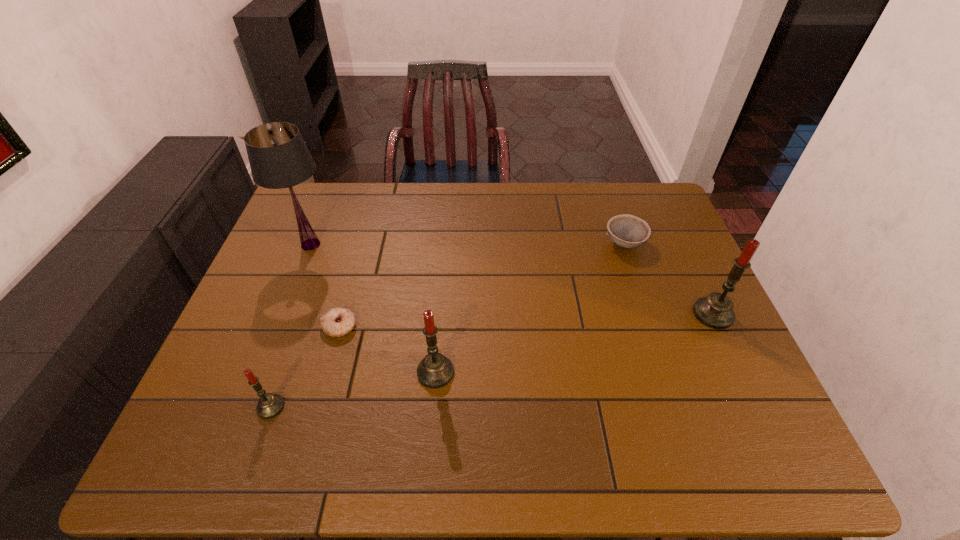
Where is `free spot between the shortest object and the second shortest candle`? free spot between the shortest object and the second shortest candle is located at coordinates (387, 349).

This screenshot has width=960, height=540. I want to click on free spot between the rightmost object and the nearest object, so click(x=492, y=360).

Where is `vacant point located between the rightmost candle and the second shortest object`? This screenshot has width=960, height=540. vacant point located between the rightmost candle and the second shortest object is located at coordinates (669, 279).

Locate an element on the screen. This screenshot has height=540, width=960. vacant area that lies between the rightmost candle and the lampshade is located at coordinates (512, 279).

At what (x,y) coordinates should I click in order to perform the action: click on free area in between the third object from left to right and the third shortest object. Please return your answer as a coordinate pair (x, y). Looking at the image, I should click on point(305,367).

You are a GUI agent. You are given a task and a screenshot of the screen. Output one action in this format:
    pyautogui.click(x=<x>, y=<y>)
    Task: Click on the empty space that is in between the second shortest object and the doughnut
    The height and width of the screenshot is (540, 960).
    Given the screenshot: What is the action you would take?
    pyautogui.click(x=482, y=285)

Where is `free space between the rightmost object and the lampshade`? free space between the rightmost object and the lampshade is located at coordinates (512, 279).

The height and width of the screenshot is (540, 960). Identify the location of free space that is in between the third object from right to left and the doughnut. (387, 349).

Locate which object is the third closest to the bowl. Please provide its 2D coordinates. Your answer should be formatted as a tuple, i.e. [(x, y)], where the tuple contains the x and y coordinates of a point satisfying the conditions above.

[(338, 321)]

Identify which object is located as the fourth nearest to the fourth tallest object. Please provide its 2D coordinates. Your answer should be formatted as a tuple, i.e. [(x, y)], where the tuple contains the x and y coordinates of a point satisfying the conditions above.

[(627, 231)]